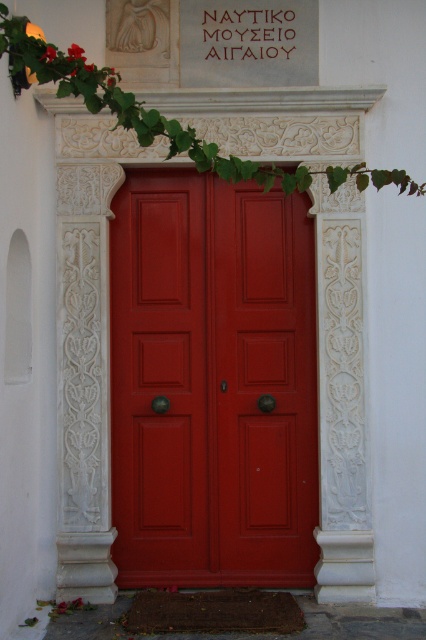
Question: Which of these objects is positioned farthest from the glossy wood door at center?

Choices:
 (A) matte wood door at center
 (B) green leafy ivy at upper center

Answer: (B)

Question: Is matte wood door at center behind green leafy ivy at upper center?

Choices:
 (A) no
 (B) yes

Answer: (B)

Question: Is glossy wood door at center bigger than matte wood door at center?

Choices:
 (A) no
 (B) yes

Answer: (B)

Question: Which object appears farthest from the camera in this image?

Choices:
 (A) matte wood door at center
 (B) glossy wood door at center
 (C) green leafy ivy at upper center

Answer: (B)

Question: Among these objects, which one is farthest from the camera?

Choices:
 (A) glossy wood door at center
 (B) matte wood door at center

Answer: (A)

Question: Is matte wood door at center positioned in front of green leafy ivy at upper center?

Choices:
 (A) yes
 (B) no

Answer: (B)